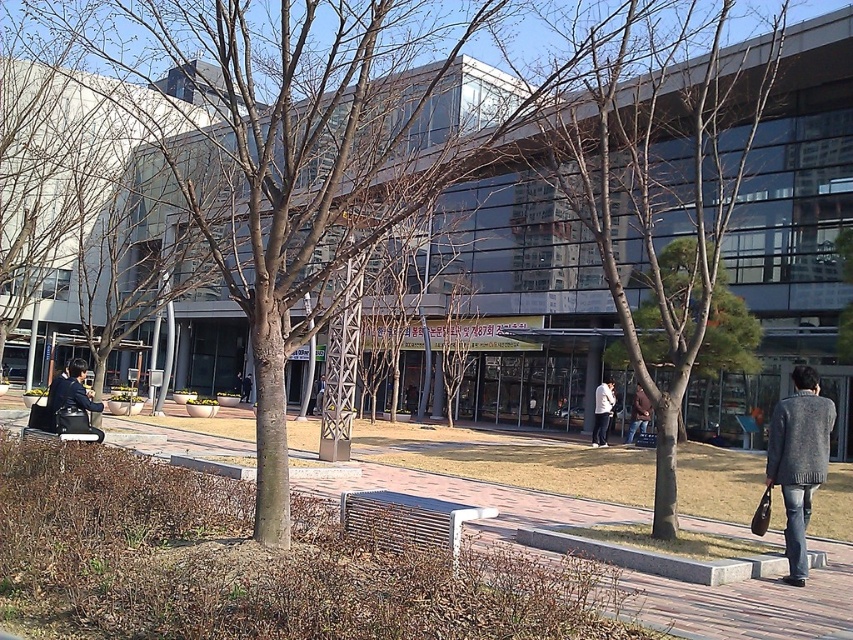
Is brick pavement at center shorter than metallic silver bench at center?

Incorrect, brick pavement at center's height does not fall short of metallic silver bench at center's.

This screenshot has height=640, width=853. Describe the element at coordinates (756, 602) in the screenshot. I see `brick pavement at center` at that location.

Where is `brick pavement at center`? This screenshot has width=853, height=640. brick pavement at center is located at coordinates (756, 602).

Is metallic silver bench at center shorter than black leather bench at lower left?

Indeed, metallic silver bench at center has a lesser height compared to black leather bench at lower left.

Which of these two, metallic silver bench at center or black leather bench at lower left, stands taller?

black leather bench at lower left

From the picture: Who is more distant from viewer, (376, 500) or (86, 426)?

Point (86, 426)

Locate an element on the screen. The width and height of the screenshot is (853, 640). metallic silver bench at center is located at coordinates (405, 518).

Can you confirm if matte black jacket at left is bigger than black leather bench at lower left?

Yes.

Is matte black jacket at left taller than black leather bench at lower left?

Yes, matte black jacket at left is taller than black leather bench at lower left.

Between point (53, 400) and point (67, 410), which one is positioned in front?

Point (67, 410) is more forward.

Locate an element on the screen. The height and width of the screenshot is (640, 853). matte black jacket at left is located at coordinates (73, 397).